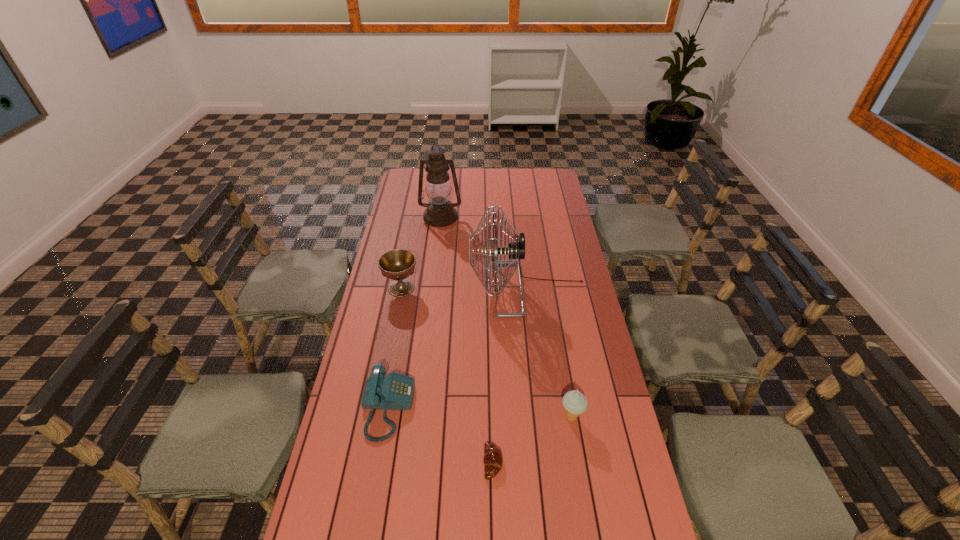
You are a GUI agent. You are given a task and a screenshot of the screen. Output one action in this format:
    pyautogui.click(x=<x>, y=<y>)
    Task: Click on the blank space at the far edge of the desktop
    
    Given the screenshot: What is the action you would take?
    pyautogui.click(x=513, y=181)

At what (x,y) coordinates should I click in order to perform the action: click on vacant point at the left edge. Please return your answer as a coordinate pair (x, y). Looking at the image, I should click on (397, 222).

This screenshot has width=960, height=540. In order to click on free space at the right edge of the desktop in this screenshot , I will do `click(596, 527)`.

Where is `free space at the far right corner`? free space at the far right corner is located at coordinates (540, 176).

Locate an element on the screen. The width and height of the screenshot is (960, 540). free spot between the fan and the fifth tallest object is located at coordinates (458, 348).

Locate an element on the screen. vacant space that's between the oil lamp and the icecream is located at coordinates (506, 317).

This screenshot has width=960, height=540. In order to click on empty location between the fan and the fifth tallest object in this screenshot , I will do click(x=458, y=348).

Where is `free space between the crescent roll and the icecream`? Image resolution: width=960 pixels, height=540 pixels. free space between the crescent roll and the icecream is located at coordinates (532, 440).

Choose which object is the fourth nearest neighbor to the icecream. Please provide its 2D coordinates. Your answer should be formatted as a tuple, i.e. [(x, y)], where the tuple contains the x and y coordinates of a point satisfying the conditions above.

[(398, 264)]

Where is `the fourth closest object to the icecream`? the fourth closest object to the icecream is located at coordinates (398, 264).